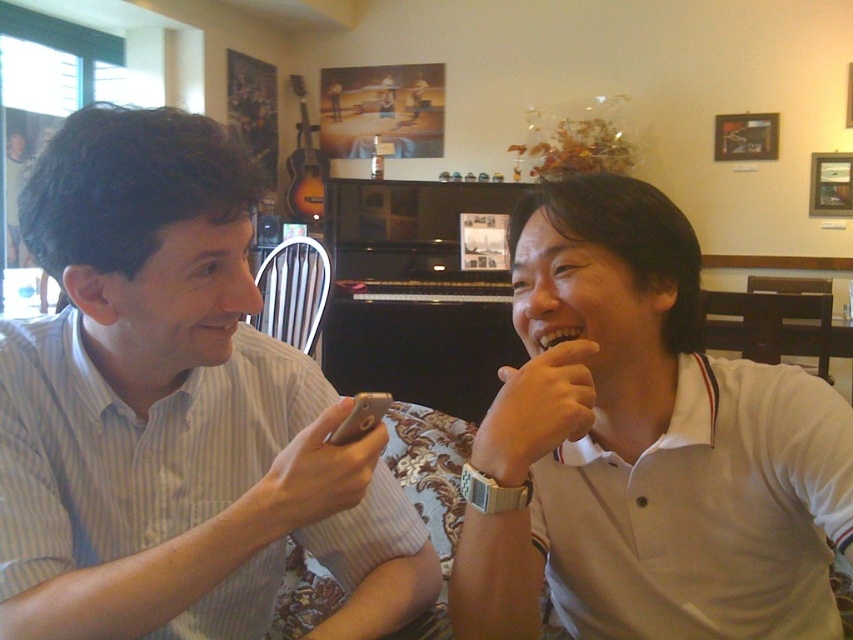
Question: Which point is farther from the camera taking this photo?

Choices:
 (A) (125, 109)
 (B) (590, 336)

Answer: (B)

Question: Does light brown striped shirt at center appear under white cotton shirt at right?

Choices:
 (A) no
 (B) yes

Answer: (A)

Question: Observing the image, what is the correct spatial positioning of light brown striped shirt at center in reference to white cotton shirt at right?

Choices:
 (A) above
 (B) below

Answer: (A)

Question: Which point is farther from the camera taking this photo?

Choices:
 (A) (738, 387)
 (B) (146, 492)

Answer: (A)

Question: Can you confirm if light brown striped shirt at center is positioned to the left of white cotton shirt at right?

Choices:
 (A) yes
 (B) no

Answer: (A)